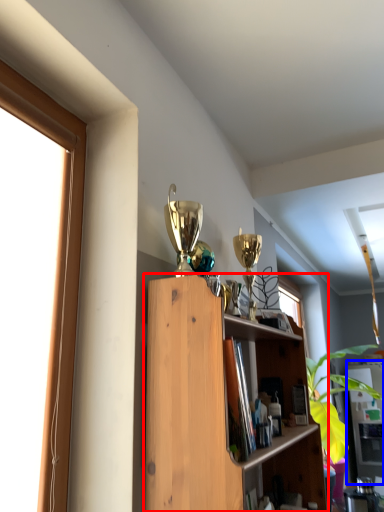
Question: Which object appears closest to the camera in this image, shelf (highlighted by a red box) or cabinet (highlighted by a blue box)?

Choices:
 (A) shelf
 (B) cabinet

Answer: (A)